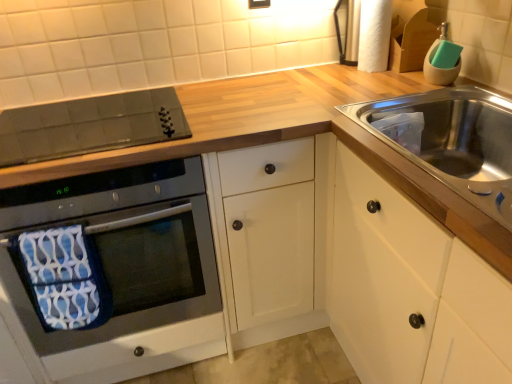
Question: Looking at the image, does white textured toilet paper at upper right seem bigger or smaller compared to black glass oven at left?

Choices:
 (A) small
 (B) big

Answer: (A)

Question: Is white textured toilet paper at upper right in front of or behind black glass oven at left in the image?

Choices:
 (A) front
 (B) behind

Answer: (B)

Question: Which object is positioned farthest from the white wood cabinet at right?

Choices:
 (A) matte black electric outlet at upper center
 (B) black glass cooktop at upper left
 (C) white textured toilet paper at upper right
 (D) black glass oven at left

Answer: (A)

Question: Estimate the real-world distances between objects in this image. Which object is farther from the black glass oven at left?

Choices:
 (A) white textured toilet paper at upper right
 (B) white wood cabinet at right
 (C) matte black electric outlet at upper center
 (D) black glass cooktop at upper left

Answer: (A)